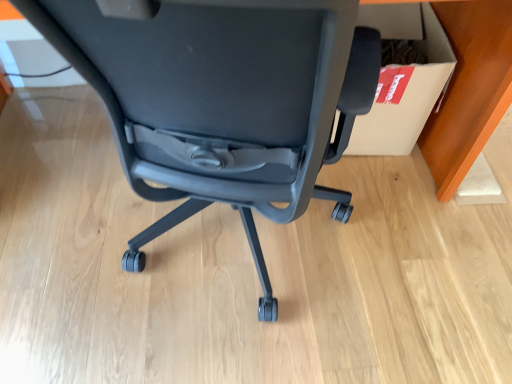
Question: Should I look upward or downward to see matte black chair at center?

Choices:
 (A) down
 (B) up

Answer: (B)

Question: Is matte black chair at center at the left side of white cardboard box at right?

Choices:
 (A) no
 (B) yes

Answer: (B)

Question: From the image's perspective, does matte black chair at center appear lower than white cardboard box at right?

Choices:
 (A) yes
 (B) no

Answer: (A)

Question: From the image's perspective, is matte black chair at center located above white cardboard box at right?

Choices:
 (A) no
 (B) yes

Answer: (A)

Question: From a real-world perspective, is matte black chair at center positioned over white cardboard box at right based on gravity?

Choices:
 (A) no
 (B) yes

Answer: (B)

Question: Does matte black chair at center have a larger size compared to white cardboard box at right?

Choices:
 (A) yes
 (B) no

Answer: (A)

Question: Is the position of matte black chair at center more distant than that of white cardboard box at right?

Choices:
 (A) no
 (B) yes

Answer: (A)

Question: From a real-world perspective, does white cardboard box at right sit lower than matte black chair at center?

Choices:
 (A) yes
 (B) no

Answer: (A)

Question: Considering the relative sizes of white cardboard box at right and matte black chair at center in the image provided, is white cardboard box at right taller than matte black chair at center?

Choices:
 (A) no
 (B) yes

Answer: (A)

Question: Does white cardboard box at right appear on the right side of matte black chair at center?

Choices:
 (A) no
 (B) yes

Answer: (B)

Question: Is the depth of white cardboard box at right greater than that of matte black chair at center?

Choices:
 (A) yes
 (B) no

Answer: (A)

Question: Can you confirm if white cardboard box at right is wider than matte black chair at center?

Choices:
 (A) no
 (B) yes

Answer: (A)

Question: Does white cardboard box at right have a lesser width compared to matte black chair at center?

Choices:
 (A) yes
 (B) no

Answer: (A)

Question: Do you think white cardboard box at right is within matte black chair at center, or outside of it?

Choices:
 (A) outside
 (B) inside

Answer: (A)